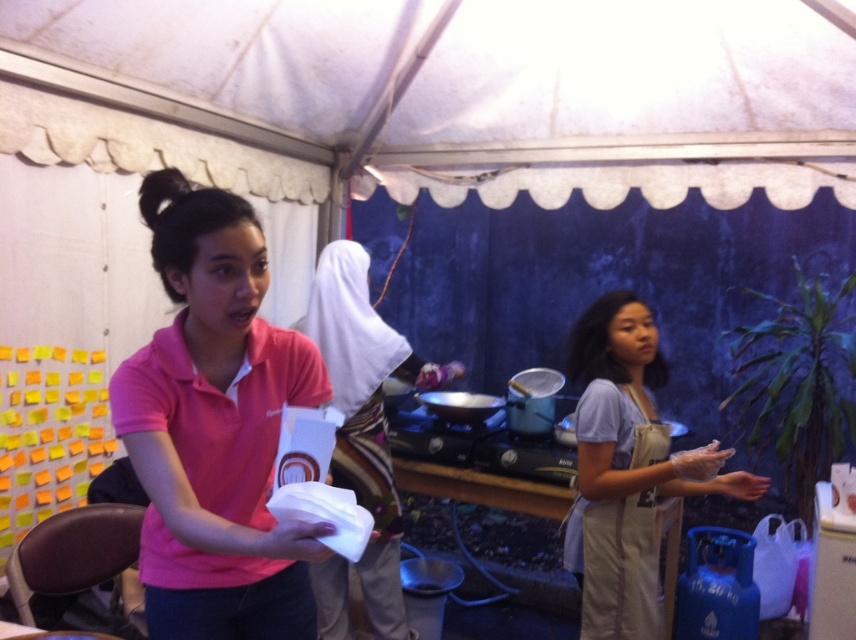
Question: Which point is closer to the camera?

Choices:
 (A) (704, 452)
 (B) (449, 362)
 (C) (186, 316)

Answer: (C)

Question: Which point appears farthest from the camera in this image?

Choices:
 (A) pos(637,634)
 (B) pos(167,355)
 (C) pos(345,458)

Answer: (C)

Question: Where is pink fabric shirt at center located in relation to white fabric headscarf at center in the image?

Choices:
 (A) above
 (B) below

Answer: (A)

Question: Does tan apron at right have a smaller size compared to white fabric headscarf at center?

Choices:
 (A) yes
 (B) no

Answer: (A)

Question: Is pink fabric shirt at center below white fabric headscarf at center?

Choices:
 (A) no
 (B) yes

Answer: (A)

Question: Which point appears farthest from the camera in this image?

Choices:
 (A) (729, 449)
 (B) (200, 449)

Answer: (A)